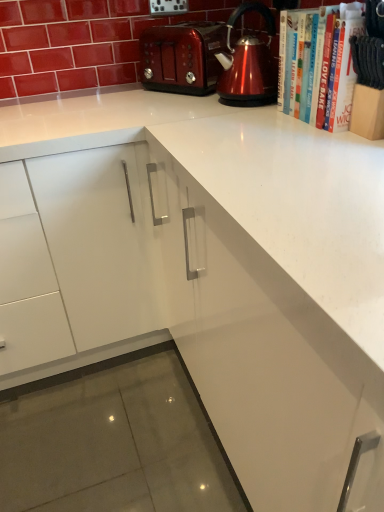
Question: Does white paper book at upper right, arranged as the 1th book when viewed from the back, come behind shiny metallic toaster at upper center?

Choices:
 (A) no
 (B) yes

Answer: (A)

Question: Is shiny metallic toaster at upper center a part of white paper book at upper right, arranged as the 1th book when viewed from the back?

Choices:
 (A) no
 (B) yes

Answer: (A)

Question: Is white paper book at upper right, arranged as the 1th book when viewed from the back, not inside shiny metallic toaster at upper center?

Choices:
 (A) no
 (B) yes

Answer: (B)

Question: Is white paper book at upper right, placed as the second book when sorted from front to back, to the right of shiny metallic toaster at upper center from the viewer's perspective?

Choices:
 (A) no
 (B) yes

Answer: (B)

Question: From a real-world perspective, is white paper book at upper right, placed as the second book when sorted from front to back, on top of shiny metallic toaster at upper center?

Choices:
 (A) no
 (B) yes

Answer: (B)

Question: Is white paper book at upper right, placed as the second book when sorted from front to back, inside or outside of shiny metallic kettle at upper right?

Choices:
 (A) outside
 (B) inside

Answer: (A)

Question: In the image, is white paper book at upper right, placed as the second book when sorted from front to back, positioned in front of or behind shiny metallic kettle at upper right?

Choices:
 (A) front
 (B) behind

Answer: (A)

Question: From their relative heights in the image, would you say white paper book at upper right, placed as the second book when sorted from front to back, is taller or shorter than shiny metallic kettle at upper right?

Choices:
 (A) short
 (B) tall

Answer: (A)

Question: From a real-world perspective, relative to shiny metallic kettle at upper right, is white paper book at upper right, placed as the second book when sorted from front to back, vertically above or below?

Choices:
 (A) above
 (B) below

Answer: (B)

Question: Which is correct: white paper book at upper right, placed as the second book when sorted from front to back, is inside shiny metallic toaster at upper center, or outside of it?

Choices:
 (A) inside
 (B) outside

Answer: (B)

Question: From the image's perspective, is white paper book at upper right, arranged as the 1th book when viewed from the back, positioned above or below shiny metallic toaster at upper center?

Choices:
 (A) below
 (B) above

Answer: (A)

Question: Visually, is white paper book at upper right, arranged as the 1th book when viewed from the back, positioned to the left or to the right of shiny metallic toaster at upper center?

Choices:
 (A) left
 (B) right

Answer: (B)

Question: Is white paper book at upper right, placed as the second book when sorted from front to back, in front of or behind shiny metallic toaster at upper center in the image?

Choices:
 (A) behind
 (B) front

Answer: (B)

Question: Is point (347, 120) closer or farther from the camera than point (153, 31)?

Choices:
 (A) farther
 (B) closer

Answer: (B)

Question: In terms of size, does white paper book at upper right, arranged as the first book when viewed from the front, appear bigger or smaller than shiny metallic toaster at upper center?

Choices:
 (A) big
 (B) small

Answer: (B)